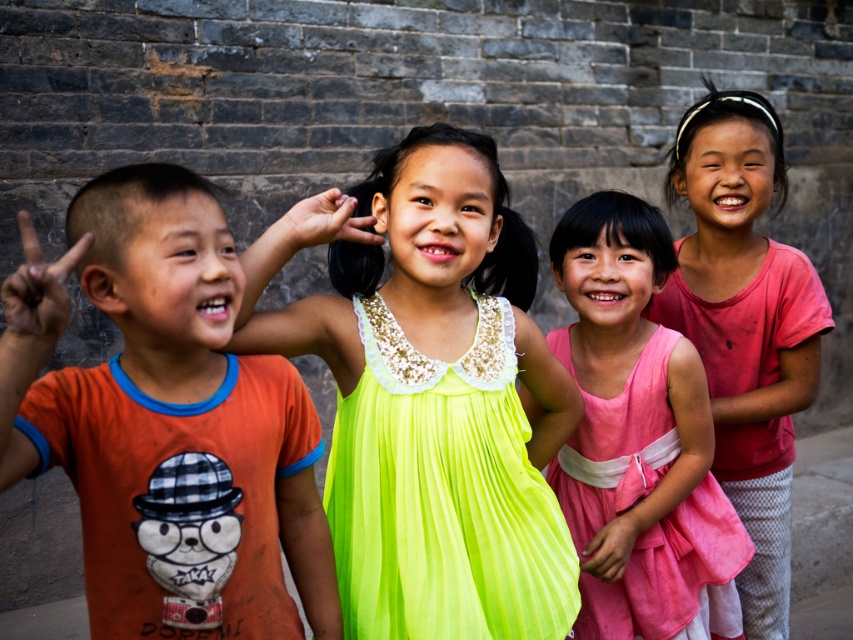
You are standing at the point labeled as point (128, 298). You want to throw a ball to a friend who is standing 2 meters away from you. Can you reach your friend with one throw?

The distance between you and your friend is 1.95 meters, which is slightly less than 2 meters. Yes, you can reach your friend with one throw.